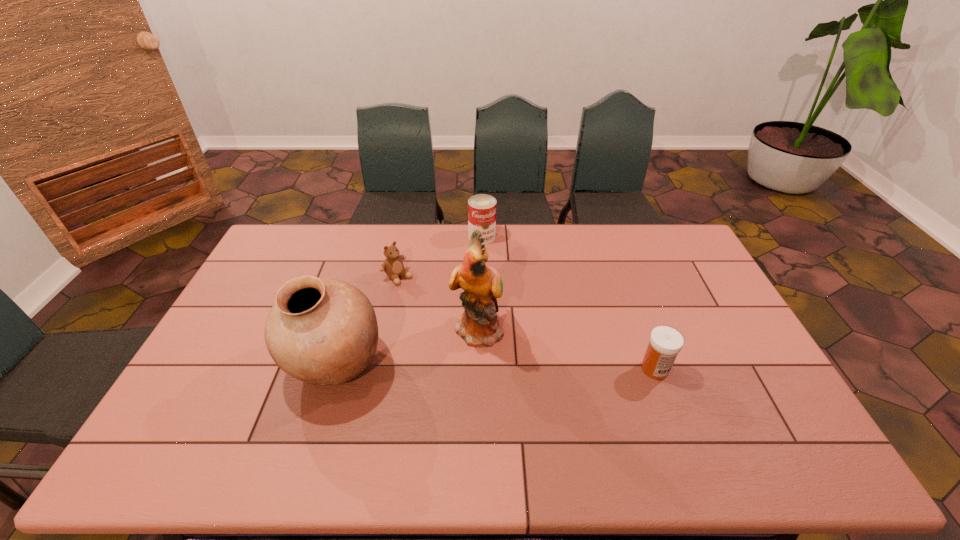
Image resolution: width=960 pixels, height=540 pixels. Identify the location of vacant space at the near edge. (593, 412).

You are a GUI agent. You are given a task and a screenshot of the screen. Output one action in this format:
    pyautogui.click(x=<x>, y=<y>)
    Task: Click on the vacant space at the left edge of the desktop
    This screenshot has height=540, width=960.
    Given the screenshot: What is the action you would take?
    pyautogui.click(x=180, y=395)

Locate an element on the screen. The image size is (960, 540). free region at the far right corner of the desktop is located at coordinates (666, 223).

I want to click on free point between the parrot and the pottery, so click(x=406, y=347).

The image size is (960, 540). I want to click on unoccupied area between the tallest object and the rightmost object, so click(566, 348).

The height and width of the screenshot is (540, 960). In order to click on free space between the teddy bear and the third shortest object in this screenshot , I will do `click(440, 256)`.

I want to click on vacant space that's between the second tallest object and the farthest object, so [x=408, y=301].

Where is `free area in between the medicine and the tallest object`? The height and width of the screenshot is (540, 960). free area in between the medicine and the tallest object is located at coordinates (566, 348).

Identify the location of empty location between the farthest object and the medicine. (568, 303).

Locate an element on the screen. Image resolution: width=960 pixels, height=540 pixels. free space between the medicine and the fourth shortest object is located at coordinates (495, 367).